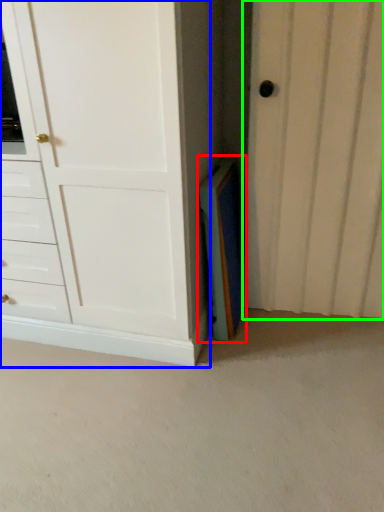
Question: Estimate the real-world distances between objects in this image. Which object is farther from paperback book (highlighted by a red box), chest of drawers (highlighted by a blue box) or door (highlighted by a green box)?

Choices:
 (A) chest of drawers
 (B) door

Answer: (A)